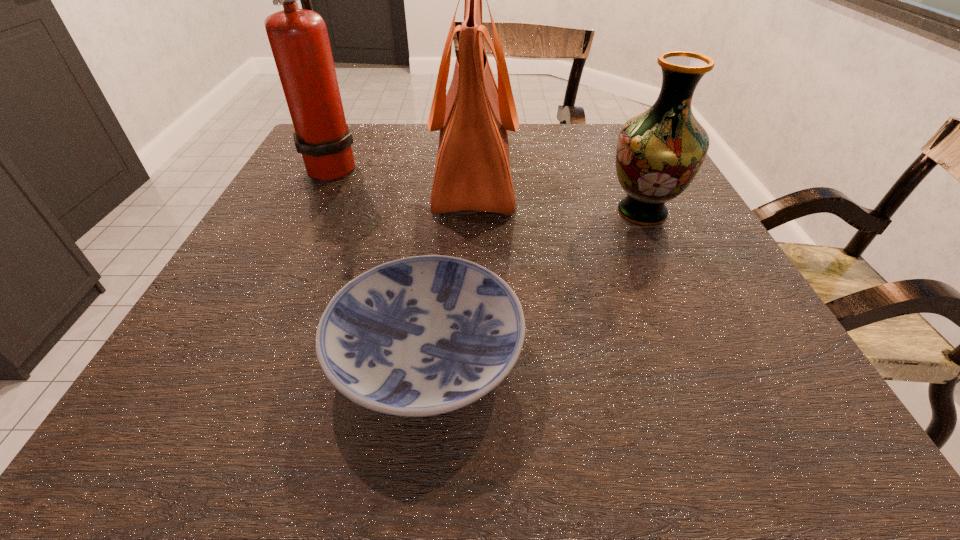
You are a GUI agent. You are given a task and a screenshot of the screen. Output one action in this format:
    pyautogui.click(x=<x>, y=<y>)
    Task: Click on the vacant space in between the vase and the shopping bag
    
    Given the screenshot: What is the action you would take?
    pyautogui.click(x=558, y=193)

The width and height of the screenshot is (960, 540). I want to click on empty space between the tallest object and the shortest object, so click(x=380, y=259).

At what (x,y) coordinates should I click in order to perform the action: click on unoccupied area between the nearest object and the rightmost object. Please return your answer as a coordinate pair (x, y). Looking at the image, I should click on (535, 282).

Locate an element on the screen. free space between the shortest object and the tallest object is located at coordinates (380, 259).

This screenshot has height=540, width=960. Find the location of `vacant point located between the leftmost object and the shortest object`. vacant point located between the leftmost object and the shortest object is located at coordinates (380, 259).

Where is `free point between the shopping bag and the fire extinguisher`? The width and height of the screenshot is (960, 540). free point between the shopping bag and the fire extinguisher is located at coordinates (403, 169).

This screenshot has width=960, height=540. In order to click on vacant area that lies between the vase and the shopping bag in this screenshot , I will do `click(558, 193)`.

Identify the location of free space between the shopping bag and the fire extinguisher. (403, 169).

Where is `the closest object to the rightmost object`? This screenshot has height=540, width=960. the closest object to the rightmost object is located at coordinates (472, 172).

This screenshot has width=960, height=540. What are the coordinates of `object that is the closest to the shopping bag` in the screenshot? It's located at (298, 38).